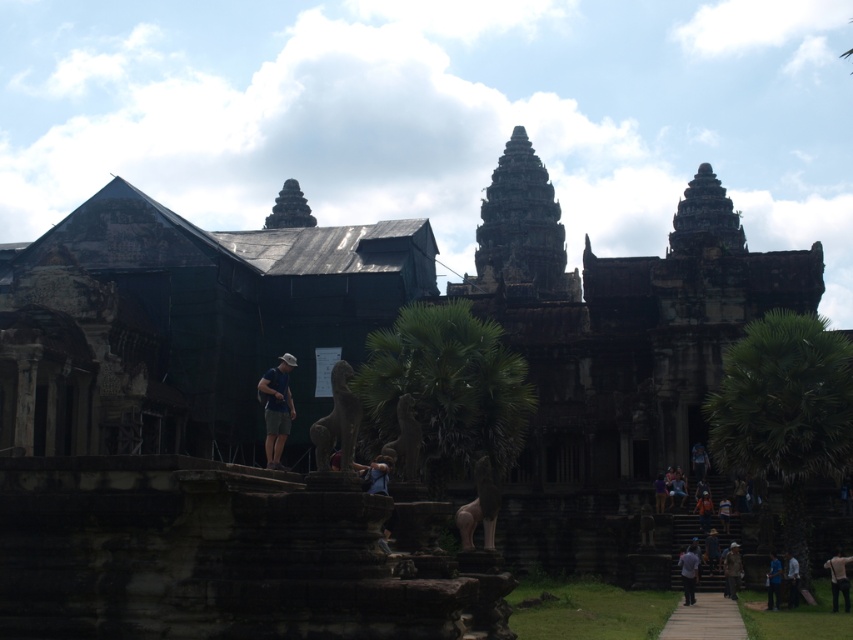
From the picture: You are a tourist visiting the temple complex and notice two items in the scene. You see the blue denim shorts at center and the brown leather jacket at lower right. Which item appears taller in the image?

The blue denim shorts at center appears taller than the brown leather jacket at lower right.

You are a tourist standing at the base of the temple steps. You see the blue denim shorts at center and the brown leather jacket at lower right. Which item is closer to you?

The brown leather jacket at lower right is closer to you since it is positioned lower in the image, indicating it is nearer than the blue denim shorts at center.